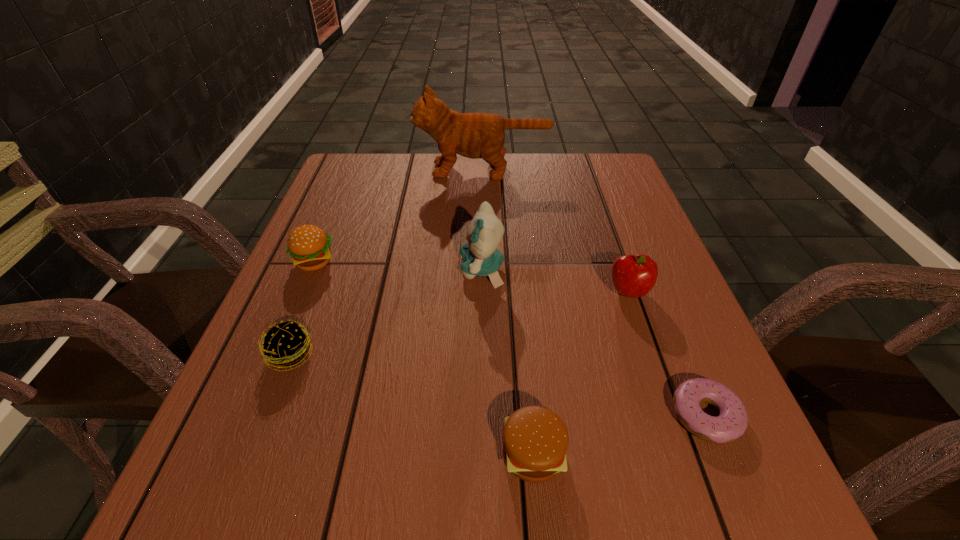
I want to click on blank area in the image that satisfies the following two spatial constraints: 1. on the face of the kitten; 2. on the right side of the shortest object, so click(x=483, y=415).

You are a GUI agent. You are given a task and a screenshot of the screen. Output one action in this format:
    pyautogui.click(x=<x>, y=<y>)
    Task: Click on the vacant position in the image that satisfies the following two spatial constraints: 1. on the face of the doughnut; 2. on the left side of the tallest object
    This screenshot has width=960, height=540.
    Given the screenshot: What is the action you would take?
    pyautogui.click(x=485, y=415)

I want to click on free space that satisfies the following two spatial constraints: 1. on the front side of the nearer hamburger; 2. on the right side of the third nearest object, so (x=252, y=454).